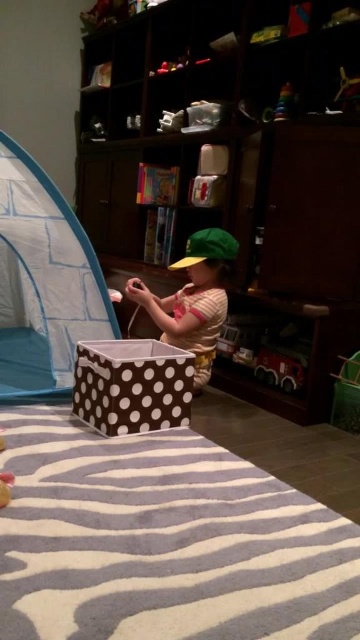
Question: Which object appears farthest from the camera in this image?

Choices:
 (A) shiny plastic toy at upper center
 (B) green fabric toddler at center
 (C) brown cardboard bookshelf at center
 (D) brown dotted fabric box at center

Answer: (A)

Question: Which of these objects is positioned closest to the brown dotted fabric box at center?

Choices:
 (A) brown cardboard bookshelf at center
 (B) green fabric toddler at center
 (C) shiny plastic toy at upper center
 (D) blue fabric tent at center

Answer: (D)

Question: Can you confirm if blue fabric tent at center is positioned above green fabric toddler at center?

Choices:
 (A) yes
 (B) no

Answer: (A)

Question: Can you confirm if green fabric toddler at center is positioned below shiny red plastic toy car at lower right?

Choices:
 (A) no
 (B) yes

Answer: (A)

Question: Can you confirm if brown cardboard bookshelf at center is positioned above shiny plastic toy at upper center?

Choices:
 (A) no
 (B) yes

Answer: (A)

Question: Which object appears farthest from the camera in this image?

Choices:
 (A) brown dotted fabric box at center
 (B) green fabric toddler at center

Answer: (B)